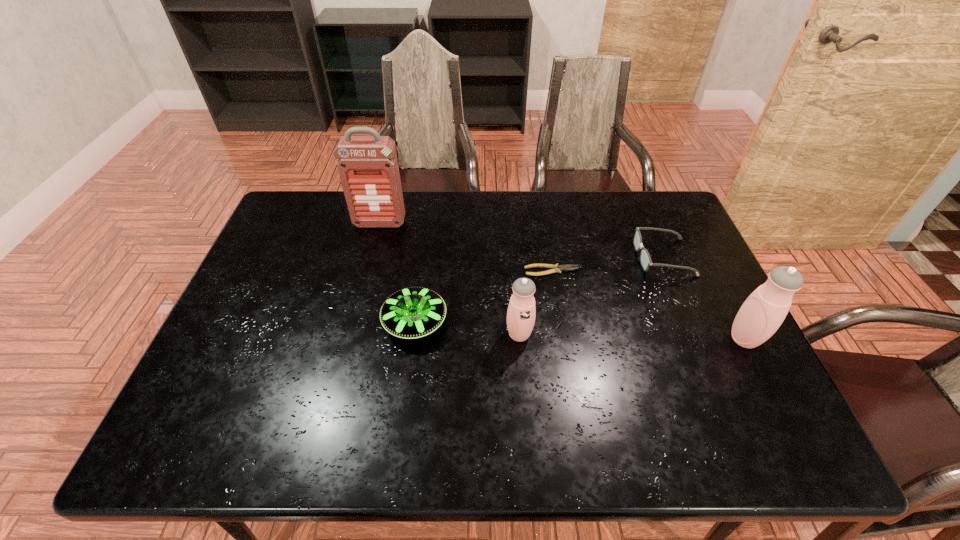
Where is `the left thermos bottle`? The height and width of the screenshot is (540, 960). the left thermos bottle is located at coordinates (521, 312).

At what (x,y) coordinates should I click in order to perform the action: click on the shorter thermos bottle. Please return your answer as a coordinate pair (x, y). The image size is (960, 540). Looking at the image, I should click on (521, 312).

The image size is (960, 540). I want to click on the fifth shortest object, so coord(762,313).

At what (x,y) coordinates should I click in order to perform the action: click on the right thermos bottle. Please return your answer as a coordinate pair (x, y). The height and width of the screenshot is (540, 960). Looking at the image, I should click on (762, 313).

Locate an element on the screen. The width and height of the screenshot is (960, 540). the farthest object is located at coordinates (368, 168).

At what (x,y) coordinates should I click in order to perform the action: click on the tallest object. Please return your answer as a coordinate pair (x, y). Looking at the image, I should click on (368, 168).

Image resolution: width=960 pixels, height=540 pixels. Find the location of `the shortest object`. the shortest object is located at coordinates (555, 268).

Identify the location of saucer. point(414,312).

Where is `spectacles`? The width and height of the screenshot is (960, 540). spectacles is located at coordinates (645, 260).

The height and width of the screenshot is (540, 960). Find the location of `vacant space situated 0.190m on the back of the fourth shortest object`. vacant space situated 0.190m on the back of the fourth shortest object is located at coordinates (515, 272).